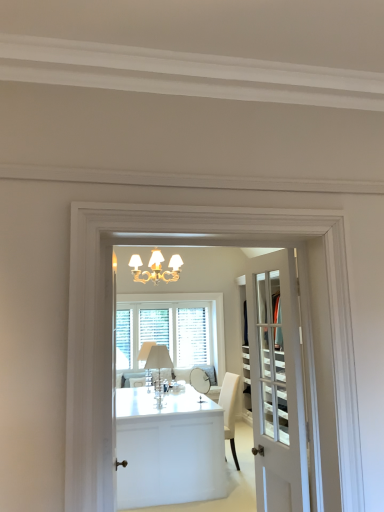
What is the approximate height of white glass lampshade at center?

25.35 inches.

What do you see at coordinates (159, 368) in the screenshot?
I see `white glass lampshade at center` at bounding box center [159, 368].

What do you see at coordinates (168, 448) in the screenshot?
I see `white glossy cabinet at center` at bounding box center [168, 448].

Find the location of a particular element. white wood window at center is located at coordinates (178, 327).

Is white glass lampshade at center taller than white wood window at center?

No, white glass lampshade at center is not taller than white wood window at center.

Considering the sizes of objects white glass lampshade at center and white wood window at center in the image provided, who is bigger, white glass lampshade at center or white wood window at center?

Bigger between the two is white wood window at center.

Choose the correct answer: Is white glass lampshade at center inside white wood window at center or outside it?

white glass lampshade at center is located beyond the bounds of white wood window at center.

Is white glass lampshade at center facing away from white wood window at center?

Yes, white glass lampshade at center is facing away from white wood window at center.

Is white wood window at center located outside white glossy cabinet at center?

That's correct, white wood window at center is outside of white glossy cabinet at center.

Between white wood window at center and white glossy cabinet at center, which one appears on the left side from the viewer's perspective?

Positioned to the left is white wood window at center.

The width and height of the screenshot is (384, 512). Identify the location of table on the right of white wood window at center. (168, 448).

From their relative heights in the image, would you say white wood window at center is taller or shorter than white glossy cabinet at center?

In the image, white wood window at center appears to be taller than white glossy cabinet at center.

Is white glossy cabinet at center oriented towards white glass door at center?

Yes, white glossy cabinet at center faces towards white glass door at center.

Is white glossy cabinet at center next to white glass door at center and touching it?

white glossy cabinet at center and white glass door at center are not in contact.

Is white glossy cabinet at center behind white glass door at center?

Yes, white glossy cabinet at center is behind white glass door at center.

From a real-world perspective, which object rests below the other?

white glossy cabinet at center.

How distant is white glass door at center from white wood window at center?

They are 8.78 feet apart.

Is point (287, 334) closer or farther from the camera than point (161, 297)?

Point (287, 334).

Is white glass door at center beside white wood window at center?

No.

Is white glass door at center aimed at white wood window at center?

No, white glass door at center is not facing towards white wood window at center.

Could you tell me if white wood window at center is facing white glass lampshade at center?

Yes.

Considering the sizes of objects white wood window at center and white glass lampshade at center in the image provided, who is wider, white wood window at center or white glass lampshade at center?

With larger width is white glass lampshade at center.

Locate an element on the screen. window behind the white glass lampshade at center is located at coordinates (178, 327).

Between white wood window at center and white glass lampshade at center, which one has more height?

white wood window at center is taller.

Do you think white glossy cabinet at center is within white wood window at center, or outside of it?

white glossy cabinet at center lies outside white wood window at center.

Is white glossy cabinet at center looking in the opposite direction of white wood window at center?

No, white glossy cabinet at center is not facing away from white wood window at center.

From the image's perspective, does white glossy cabinet at center appear higher than white wood window at center?

Actually, white glossy cabinet at center appears below white wood window at center in the image.

Locate an element on the screen. The height and width of the screenshot is (512, 384). table below the white wood window at center (from the image's perspective) is located at coordinates (168, 448).

Where is `lamp that appears above the white glossy cabinet at center (from the image's perspective)`? This screenshot has height=512, width=384. lamp that appears above the white glossy cabinet at center (from the image's perspective) is located at coordinates (159, 368).

Who is bigger, white glossy cabinet at center or white glass lampshade at center?

white glossy cabinet at center.

Considering the relative sizes of white glossy cabinet at center and white glass lampshade at center in the image provided, is white glossy cabinet at center shorter than white glass lampshade at center?

No, white glossy cabinet at center is not shorter than white glass lampshade at center.

Where is `lamp located on the left of white wood window at center`? The height and width of the screenshot is (512, 384). lamp located on the left of white wood window at center is located at coordinates (159, 368).

Identify the location of window located behind the white glossy cabinet at center. (178, 327).

Which object lies further to the anchor point white glossy cabinet at center, white glass lampshade at center or white wood window at center?

white wood window at center lies further to white glossy cabinet at center than the other object.

Which object lies further to the anchor point white wood window at center, white glass door at center or white glossy cabinet at center?

white glass door at center lies further to white wood window at center than the other object.

From the image, which object appears to be farther from white glass lampshade at center, white wood window at center or white glass door at center?

The object further to white glass lampshade at center is white glass door at center.

Estimate the real-world distances between objects in this image. Which object is further from white glass door at center, white glossy cabinet at center or white wood window at center?

white wood window at center is positioned further to the anchor white glass door at center.

In the scene shown: Considering their positions, is white wood window at center positioned closer to white glass lampshade at center than white glossy cabinet at center?

white glossy cabinet at center is positioned closer to the anchor white glass lampshade at center.

Looking at the image, which one is located further to white wood window at center, white glass door at center or white glass lampshade at center?

white glass door at center is positioned further to the anchor white wood window at center.

Which object lies nearer to the anchor point white wood window at center, white glass lampshade at center or white glossy cabinet at center?

white glass lampshade at center is positioned closer to the anchor white wood window at center.

Looking at the image, which one is located further to white glass lampshade at center, white glass door at center or white glossy cabinet at center?

The object further to white glass lampshade at center is white glass door at center.

At what (x,y) coordinates should I click in order to perform the action: click on table between white glass door at center and white wood window at center in the front-back direction. Please return your answer as a coordinate pair (x, y). This screenshot has width=384, height=512. Looking at the image, I should click on (168, 448).

In order to click on lamp located between white glossy cabinet at center and white wood window at center in the depth direction in this screenshot , I will do `click(159, 368)`.

Identify the location of lamp between white glass door at center and white wood window at center in the front-back direction. Image resolution: width=384 pixels, height=512 pixels. (159, 368).

At what (x,y) coordinates should I click in order to perform the action: click on table between white glass door at center and white glass lampshade at center along the z-axis. Please return your answer as a coordinate pair (x, y). Image resolution: width=384 pixels, height=512 pixels. Looking at the image, I should click on (168, 448).